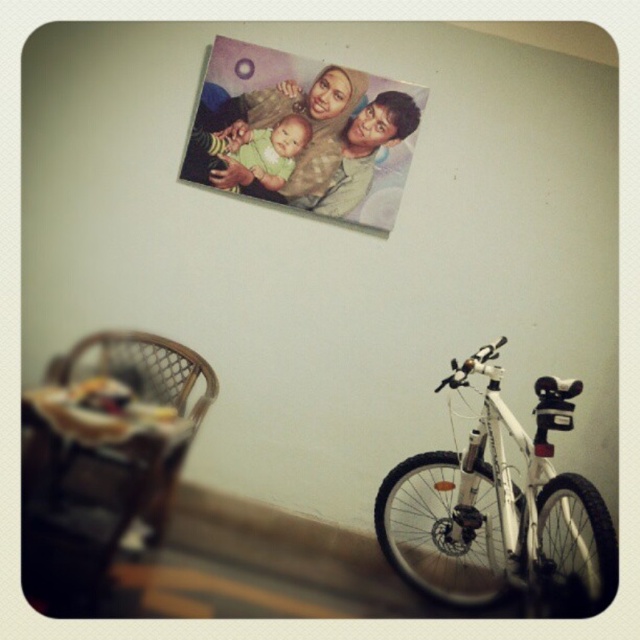
Between matte plastic photo at upper center and wooden highchair at lower left, which one appears on the right side from the viewer's perspective?

Positioned to the right is matte plastic photo at upper center.

Does matte plastic photo at upper center have a lesser height compared to wooden highchair at lower left?

In fact, matte plastic photo at upper center may be taller than wooden highchair at lower left.

What do you see at coordinates (304, 134) in the screenshot?
I see `matte plastic photo at upper center` at bounding box center [304, 134].

This screenshot has width=640, height=640. Identify the location of matte plastic photo at upper center. (304, 134).

Does white matte bicycle at lower right appear over woven rattan chair at lower left?

Actually, white matte bicycle at lower right is below woven rattan chair at lower left.

Does white matte bicycle at lower right have a lesser height compared to woven rattan chair at lower left?

Incorrect, white matte bicycle at lower right's height does not fall short of woven rattan chair at lower left's.

This screenshot has width=640, height=640. Describe the element at coordinates (499, 509) in the screenshot. I see `white matte bicycle at lower right` at that location.

This screenshot has height=640, width=640. Identify the location of white matte bicycle at lower right. (499, 509).

Which is in front, point (580, 476) or point (140, 410)?

Point (580, 476) is more forward.

Between white matte bicycle at lower right and wooden highchair at lower left, which one is positioned lower?

white matte bicycle at lower right is below.

Who is more forward, (557, 560) or (129, 461)?

Point (129, 461)

Locate an element on the screen. white matte bicycle at lower right is located at coordinates (499, 509).